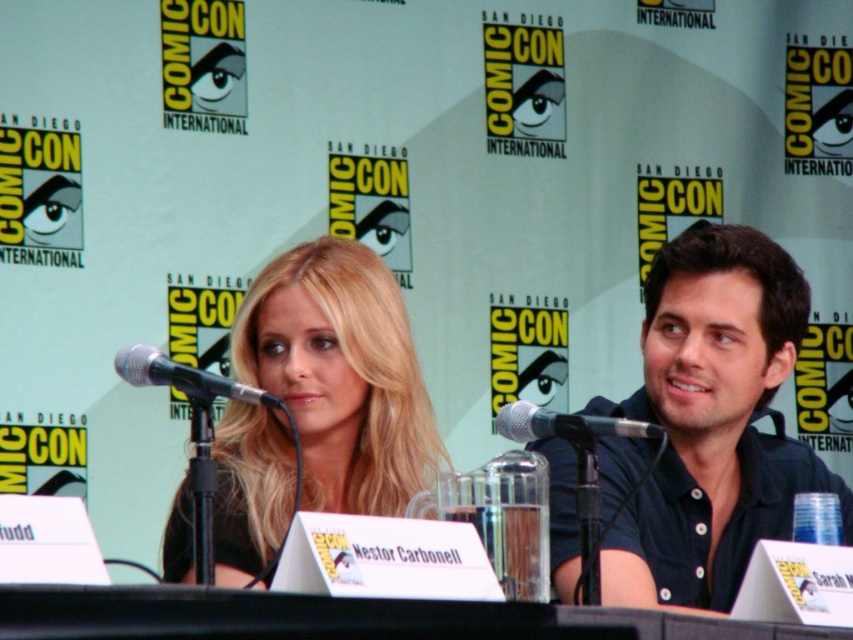
Does dark blue shirt at center appear under silver metallic microphone at center?

Correct, dark blue shirt at center is located below silver metallic microphone at center.

Does dark blue shirt at center have a lesser width compared to silver metallic microphone at center?

In fact, dark blue shirt at center might be wider than silver metallic microphone at center.

Between point (714, 273) and point (526, 440), which one is positioned behind?

The point (714, 273) is more distant.

Locate an element on the screen. dark blue shirt at center is located at coordinates (712, 420).

Is point (631, 566) closer to camera compared to point (355, 333)?

Yes, it is.

This screenshot has width=853, height=640. I want to click on dark blue shirt at center, so pos(712,420).

This screenshot has height=640, width=853. I want to click on dark blue shirt at center, so click(712, 420).

Locate an element on the screen. This screenshot has width=853, height=640. dark blue shirt at center is located at coordinates (712, 420).

From the picture: Between dark blue shirt at center and black metallic microphone at left, which one appears on the right side from the viewer's perspective?

Positioned to the right is dark blue shirt at center.

Find the location of `dark blue shirt at center`. dark blue shirt at center is located at coordinates (712, 420).